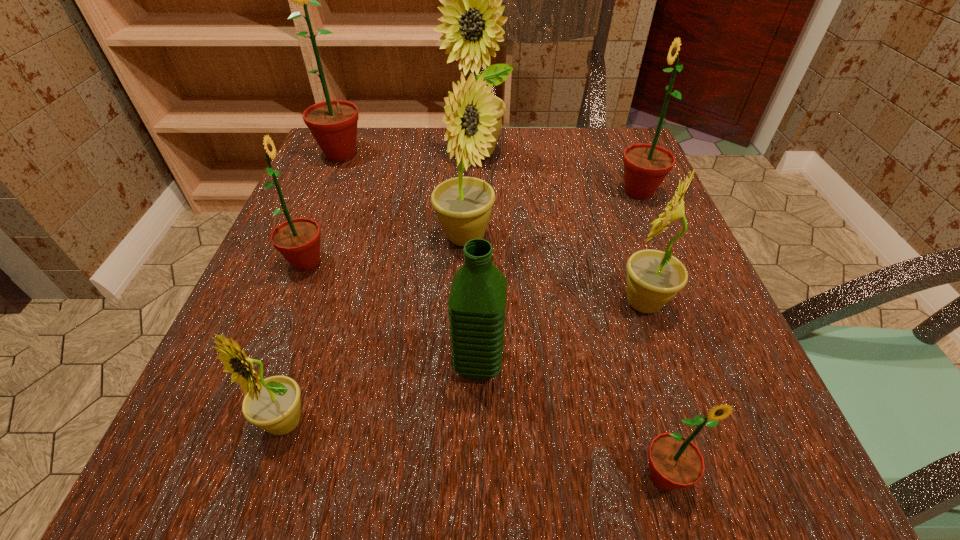
Locate an element on the screen. The width and height of the screenshot is (960, 540). free point located 0.150m on the face of the third nearest sunflower is located at coordinates (520, 302).

This screenshot has width=960, height=540. In order to click on free space located on the face of the third nearest sunflower in this screenshot , I will do `click(520, 302)`.

Locate an element on the screen. This screenshot has width=960, height=540. blank space located on the face of the third nearest sunflower is located at coordinates (520, 302).

Find the location of a particular element. The width and height of the screenshot is (960, 540). vacant space located 0.190m on the face of the third farthest green sunflower is located at coordinates (438, 262).

Image resolution: width=960 pixels, height=540 pixels. Identify the location of free spot located 0.090m on the front of the seventh farthest object. (478, 452).

Where is `vacant position located 0.060m on the face of the eighth farthest object`? vacant position located 0.060m on the face of the eighth farthest object is located at coordinates (259, 501).

Locate an element on the screen. object located at the far left corner is located at coordinates (333, 123).

Find the location of a particular element. object present at the near left corner is located at coordinates tap(273, 404).

Find the location of a particular element. This screenshot has height=540, width=960. object that is at the far right corner is located at coordinates (645, 165).

Locate an element on the screen. The image size is (960, 540). object located in the near right corner section of the desktop is located at coordinates (675, 462).